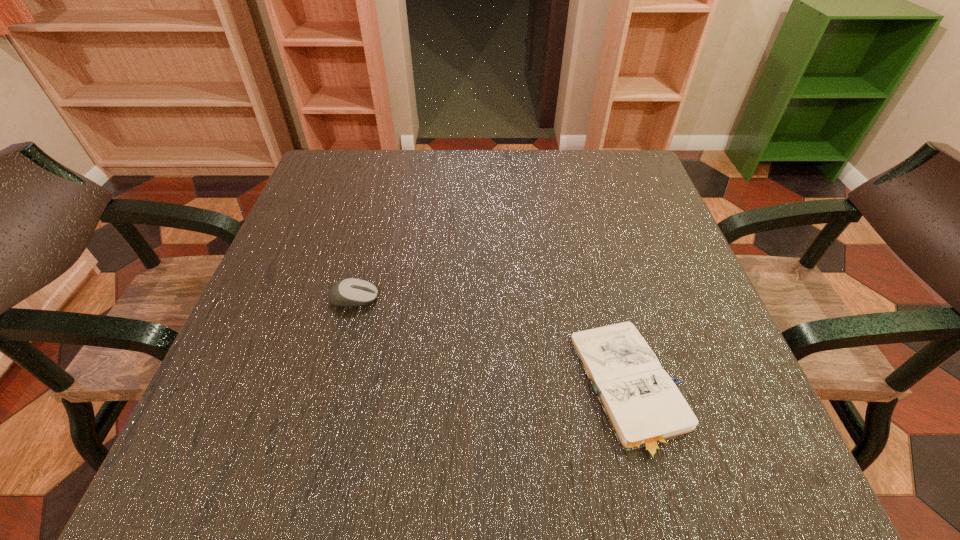
In the image, there is a desktop. Identify the location of vacant space at the far edge. (521, 176).

Identify the location of vacant region at the near edge of the desktop. tap(357, 480).

You are a GUI agent. You are given a task and a screenshot of the screen. Output one action in this format:
    pyautogui.click(x=<x>, y=<y>)
    Task: Click on the free space at the left edge
    The height and width of the screenshot is (540, 960).
    Given the screenshot: What is the action you would take?
    pyautogui.click(x=301, y=387)

Where is `vacant region at the right edge of the desktop`? vacant region at the right edge of the desktop is located at coordinates (643, 204).

Locate an element on the screen. vacant space at the far left corner of the desktop is located at coordinates (360, 160).

Identify the location of vacant point at the near right corner. Image resolution: width=960 pixels, height=540 pixels. (671, 470).

I want to click on free space that satisfies the following two spatial constraints: 1. on the wheel side of the shorter object; 2. on the left side of the computer equipment, so click(x=330, y=389).

Locate an element on the screen. This screenshot has height=540, width=960. free location that satisfies the following two spatial constraints: 1. on the wheel side of the shorter object; 2. on the left side of the taller object is located at coordinates (330, 389).

Where is `free point that satisfies the following two spatial constraints: 1. on the wheel side of the right object; 2. on the left side of the taller object`? This screenshot has height=540, width=960. free point that satisfies the following two spatial constraints: 1. on the wheel side of the right object; 2. on the left side of the taller object is located at coordinates (330, 389).

Locate an element on the screen. Image resolution: width=960 pixels, height=540 pixels. free location that satisfies the following two spatial constraints: 1. on the wheel side of the shorter object; 2. on the left side of the left object is located at coordinates (330, 389).